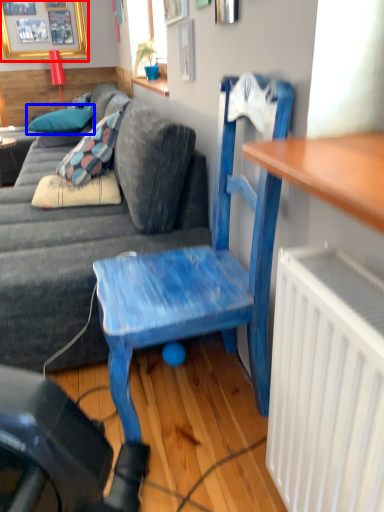
Question: Which object appears closest to the camera in this image, picture frame (highlighted by a red box) or pillow (highlighted by a blue box)?

Choices:
 (A) picture frame
 (B) pillow

Answer: (B)